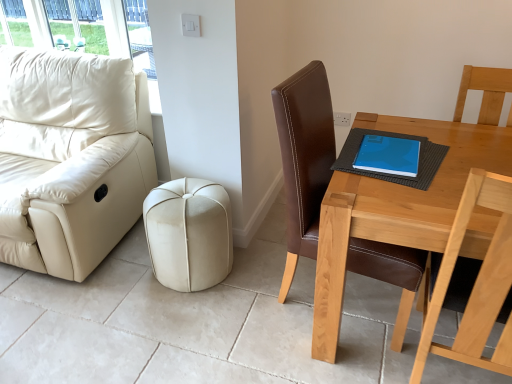
You are a GUI agent. You are given a task and a screenshot of the screen. Output one action in this format:
    pyautogui.click(x=<x>, y=<y>)
    Task: Click on the blank space situated above beige leather ottoman at center (from a real-world perspective)
    
    Given the screenshot: What is the action you would take?
    pyautogui.click(x=179, y=198)